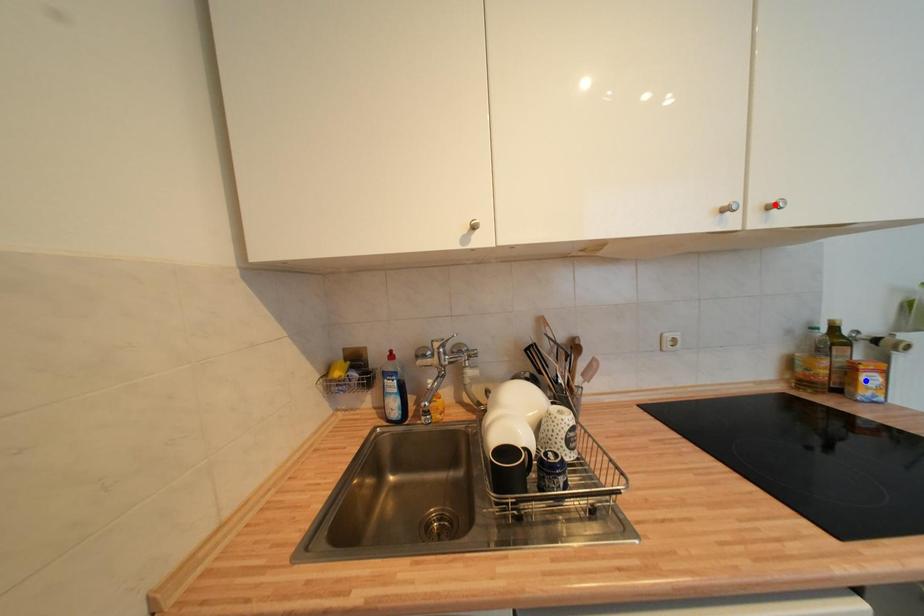
Question: Two points are marked on the image. Which point is closer to the camera?

Choices:
 (A) Blue point is closer.
 (B) Red point is closer.

Answer: (B)